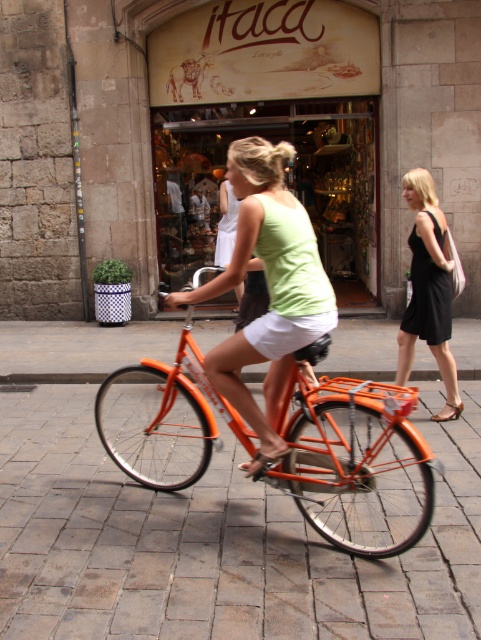
Between matte glass storefront at center and matte green tank top at center, which one appears on the right side from the viewer's perspective?

From the viewer's perspective, matte glass storefront at center appears more on the right side.

Who is higher up, matte glass storefront at center or matte green tank top at center?

Positioned higher is matte glass storefront at center.

Is point (239, 109) positioned before point (262, 216)?

No, it is behind (262, 216).

Where is `matte glass storefront at center`? This screenshot has height=640, width=481. matte glass storefront at center is located at coordinates (286, 182).

Can you confirm if orange metallic bicycle at center is positioned below matte glass storefront at center?

Correct, orange metallic bicycle at center is located below matte glass storefront at center.

You are a GUI agent. You are given a task and a screenshot of the screen. Output one action in this format:
    pyautogui.click(x=<x>, y=<y>)
    Task: Click on the orange metallic bicycle at center
    This screenshot has height=640, width=481.
    Given the screenshot: What is the action you would take?
    pyautogui.click(x=357, y=465)

Does point (316, 348) come closer to viewer compared to point (281, 118)?

That is True.

At what (x,y) coordinates should I click in order to perform the action: click on orange metallic bicycle at center. Please return your answer as a coordinate pair (x, y). Looking at the image, I should click on (357, 465).

Which is above, orange metallic bicycle at center or black dress at right?

Positioned higher is black dress at right.

Based on the photo, is orange metallic bicycle at center below black dress at right?

Indeed, orange metallic bicycle at center is positioned under black dress at right.

Which is in front, point (229, 422) or point (430, 298)?

Point (229, 422) is more forward.

Where is `orange metallic bicycle at center`? orange metallic bicycle at center is located at coordinates click(x=357, y=465).